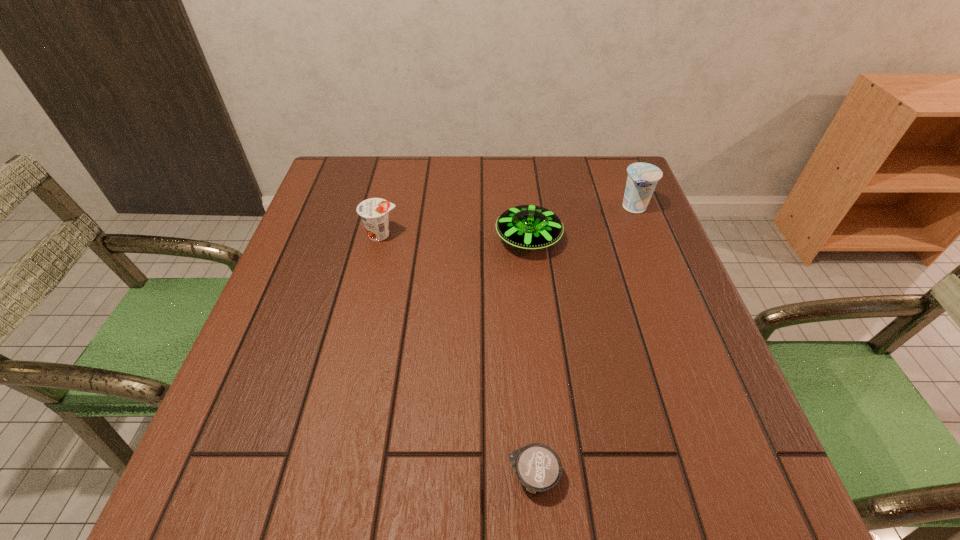
At what (x,y) coordinates should I click in order to perform the action: click on the farthest object. Please return your answer as a coordinate pair (x, y). Looking at the image, I should click on (642, 179).

Where is `the farthest yogurt`? Image resolution: width=960 pixels, height=540 pixels. the farthest yogurt is located at coordinates (642, 179).

Locate an element on the screen. This screenshot has height=540, width=960. the second nearest yogurt is located at coordinates (374, 212).

Where is `the leftmost yogurt`? the leftmost yogurt is located at coordinates (374, 212).

Locate an element on the screen. Image resolution: width=960 pixels, height=540 pixels. saucer is located at coordinates (530, 227).

Locate an element on the screen. the second yogurt from left to right is located at coordinates (538, 467).

Where is `the shortest yogurt`? This screenshot has height=540, width=960. the shortest yogurt is located at coordinates (538, 467).

Identify the location of free location located on the left of the farthest yogurt. (481, 207).

The height and width of the screenshot is (540, 960). In order to click on blank space located 0.400m on the front of the second shortest yogurt in this screenshot , I will do `click(343, 396)`.

In order to click on free space located on the back of the saucer in this screenshot , I will do `click(524, 205)`.